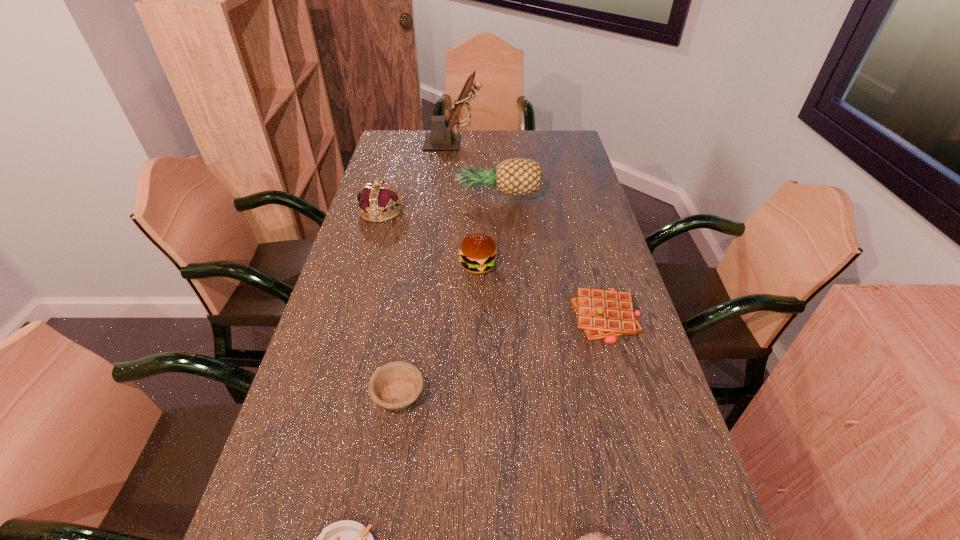
Find the location of a particular element. Image resolution: width=960 pixels, height=540 pixels. free spot that satisfies the following two spatial constraints: 1. on the front-facing side of the farthest object; 2. on the left side of the pineapple is located at coordinates (448, 197).

Find the location of a particular element. vacant area in the image that satisfies the following two spatial constraints: 1. on the front-facing side of the figurine; 2. on the back side of the rightmost object is located at coordinates (437, 317).

This screenshot has width=960, height=540. What are the coordinates of `vacant space that satisfies the following two spatial constraints: 1. on the front side of the crown; 2. on the right side of the fifth shortest object` in the screenshot? It's located at (366, 266).